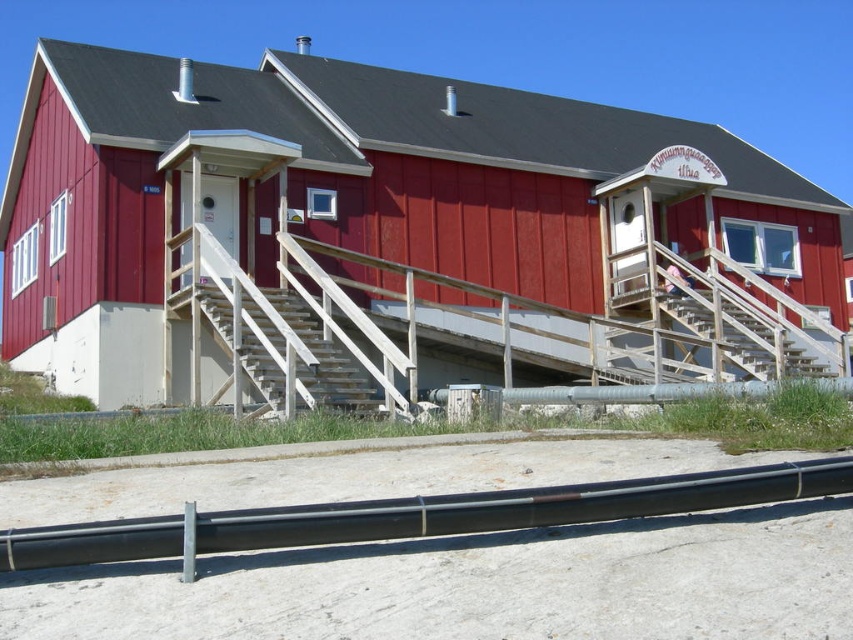
You are a delivery person carrying a package that requires a clear path to the smooth red wooden hut at center. There are wooden stairs at lower right nearby. Can you safely navigate to the hut without needing to climb the stairs?

The smooth red wooden hut at center and wooden stairs at lower right are 4.55 meters apart from each other, so yes, you can safely navigate to the smooth red wooden hut at center without needing to climb the stairs as they are separated by that distance.

You are a painter who needs to paint the black metal rail at lower center and the wooden stairs at center. Which object requires more paint because it is taller?

The wooden stairs at center require more paint because they are taller than the black metal rail at lower center.